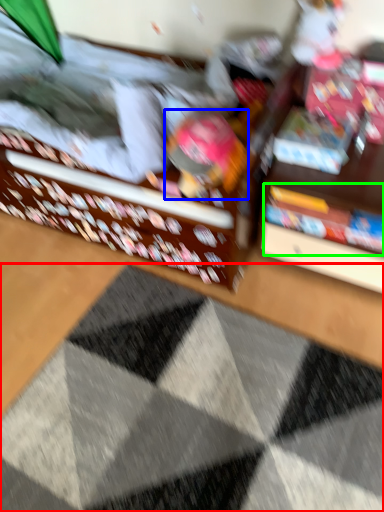
Question: Estimate the real-world distances between objects in this image. Which object is farther from doormat (highlighted by a red box), toy (highlighted by a blue box) or book (highlighted by a green box)?

Choices:
 (A) toy
 (B) book

Answer: (A)